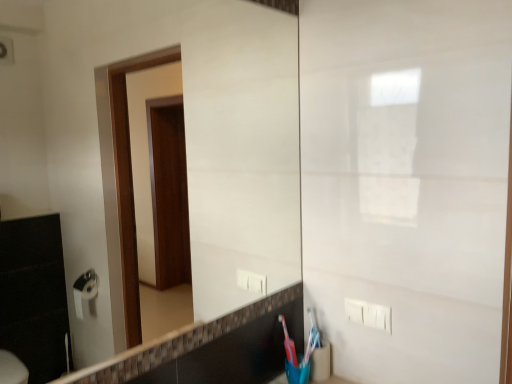
Describe the element at coordinates (368, 314) in the screenshot. I see `white plastic electric outlet at lower right` at that location.

The height and width of the screenshot is (384, 512). What are the coordinates of `white plastic electric outlet at lower right` in the screenshot? It's located at (368, 314).

Find the location of a particular element. translucent plastic toothbrush at lower right is located at coordinates (313, 330).

What do you see at coordinates (313, 330) in the screenshot? The width and height of the screenshot is (512, 384). I see `translucent plastic toothbrush at lower right` at bounding box center [313, 330].

At what (x,y) coordinates should I click in order to perform the action: click on white plastic electric outlet at lower right. Please return your answer as a coordinate pair (x, y). The height and width of the screenshot is (384, 512). Looking at the image, I should click on (368, 314).

Which is more to the right, translucent plastic toothbrush at lower right or white plastic electric outlet at lower right?

white plastic electric outlet at lower right.

Considering their positions, is translucent plastic toothbrush at lower right located in front of or behind white plastic electric outlet at lower right?

Clearly, translucent plastic toothbrush at lower right is behind white plastic electric outlet at lower right.

Does point (311, 320) appear closer or farther from the camera than point (356, 313)?

Point (311, 320) appears to be farther away from the viewer than point (356, 313).

From the image's perspective, which one is positioned higher, translucent plastic toothbrush at lower right or white plastic electric outlet at lower right?

From the image's view, white plastic electric outlet at lower right is above.

From a real-world perspective, does translucent plastic toothbrush at lower right sit lower than white plastic electric outlet at lower right?

Indeed, from a real-world perspective, translucent plastic toothbrush at lower right is positioned beneath white plastic electric outlet at lower right.

Is translucent plastic toothbrush at lower right wider or thinner than white plastic electric outlet at lower right?

translucent plastic toothbrush at lower right is wider than white plastic electric outlet at lower right.

Considering the relative sizes of translucent plastic toothbrush at lower right and white plastic electric outlet at lower right in the image provided, is translucent plastic toothbrush at lower right taller than white plastic electric outlet at lower right?

Yes, translucent plastic toothbrush at lower right is taller than white plastic electric outlet at lower right.

Considering the sizes of objects translucent plastic toothbrush at lower right and white plastic electric outlet at lower right in the image provided, who is smaller, translucent plastic toothbrush at lower right or white plastic electric outlet at lower right?

Smaller between the two is translucent plastic toothbrush at lower right.

Choose the correct answer: Is translucent plastic toothbrush at lower right inside white plastic electric outlet at lower right or outside it?

translucent plastic toothbrush at lower right is not enclosed by white plastic electric outlet at lower right.

Is translucent plastic toothbrush at lower right not close to white plastic electric outlet at lower right?

translucent plastic toothbrush at lower right is near white plastic electric outlet at lower right, not far away.

Is translucent plastic toothbrush at lower right looking in the opposite direction of white plastic electric outlet at lower right?

No, translucent plastic toothbrush at lower right's orientation is not away from white plastic electric outlet at lower right.

Can you tell me how much translucent plastic toothbrush at lower right and white plastic electric outlet at lower right differ in facing direction?

translucent plastic toothbrush at lower right and white plastic electric outlet at lower right are facing 88.9 degrees away from each other.

Could you measure the distance between translucent plastic toothbrush at lower right and white plastic electric outlet at lower right?

The distance of translucent plastic toothbrush at lower right from white plastic electric outlet at lower right is 19.67 centimeters.

Image resolution: width=512 pixels, height=384 pixels. I want to click on electric outlet in front of the translucent plastic toothbrush at lower right, so click(x=368, y=314).

Which object is positioned more to the left, white plastic electric outlet at lower right or translucent plastic toothbrush at lower right?

Positioned to the left is translucent plastic toothbrush at lower right.

Between white plastic electric outlet at lower right and translucent plastic toothbrush at lower right, which one is positioned behind?

translucent plastic toothbrush at lower right is behind.

Which is nearer, (354, 310) or (313, 328)?

Positioned in front is point (354, 310).

From the image's perspective, relative to translucent plastic toothbrush at lower right, is white plastic electric outlet at lower right above or below?

white plastic electric outlet at lower right is situated higher than translucent plastic toothbrush at lower right in the image.

From a real-world perspective, is white plastic electric outlet at lower right physically above translucent plastic toothbrush at lower right?

A: Indeed, from a real-world perspective, white plastic electric outlet at lower right stands above translucent plastic toothbrush at lower right.

Which of these two, white plastic electric outlet at lower right or translucent plastic toothbrush at lower right, is wider?

translucent plastic toothbrush at lower right is wider.

From the picture: Considering the sizes of objects white plastic electric outlet at lower right and translucent plastic toothbrush at lower right in the image provided, who is taller, white plastic electric outlet at lower right or translucent plastic toothbrush at lower right?

Standing taller between the two is translucent plastic toothbrush at lower right.

Is white plastic electric outlet at lower right bigger or smaller than translucent plastic toothbrush at lower right?

Considering their sizes, white plastic electric outlet at lower right takes up more space than translucent plastic toothbrush at lower right.

Is white plastic electric outlet at lower right outside of translucent plastic toothbrush at lower right?

white plastic electric outlet at lower right lies outside translucent plastic toothbrush at lower right's area.

Is white plastic electric outlet at lower right far away from translucent plastic toothbrush at lower right?

white plastic electric outlet at lower right is near translucent plastic toothbrush at lower right, not far away.

Is white plastic electric outlet at lower right facing towards translucent plastic toothbrush at lower right?

No, white plastic electric outlet at lower right is not oriented towards translucent plastic toothbrush at lower right.

What's the angular difference between white plastic electric outlet at lower right and translucent plastic toothbrush at lower right's facing directions?

There is a 88.9-degree angle between the facing directions of white plastic electric outlet at lower right and translucent plastic toothbrush at lower right.

Where is `toothbrush below the white plastic electric outlet at lower right (from a real-world perspective)`? This screenshot has width=512, height=384. toothbrush below the white plastic electric outlet at lower right (from a real-world perspective) is located at coordinates (313, 330).

This screenshot has height=384, width=512. What are the coordinates of `electric outlet on the right side of translucent plastic toothbrush at lower right` in the screenshot? It's located at point(368,314).

At what (x,y) coordinates should I click in order to perform the action: click on electric outlet above the translucent plastic toothbrush at lower right (from a real-world perspective). Please return your answer as a coordinate pair (x, y). This screenshot has height=384, width=512. Looking at the image, I should click on (368, 314).